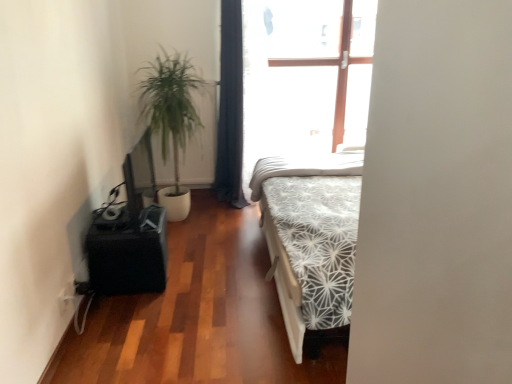
Question: Does black matte table at left appear on the left side of white textured mattress at center?

Choices:
 (A) no
 (B) yes

Answer: (B)

Question: Is the depth of black matte table at left less than that of white textured mattress at center?

Choices:
 (A) no
 (B) yes

Answer: (B)

Question: Is black matte table at left beside white textured mattress at center?

Choices:
 (A) yes
 (B) no

Answer: (B)

Question: Can you confirm if black matte table at left is bigger than white textured mattress at center?

Choices:
 (A) no
 (B) yes

Answer: (A)

Question: From the image's perspective, is black matte table at left located above white textured mattress at center?

Choices:
 (A) yes
 (B) no

Answer: (B)

Question: Considering the relative positions of dark blue fabric curtain at center and green leafy plant at left in the image provided, is dark blue fabric curtain at center to the left or to the right of green leafy plant at left?

Choices:
 (A) left
 (B) right

Answer: (B)

Question: Considering the positions of dark blue fabric curtain at center and green leafy plant at left in the image, is dark blue fabric curtain at center wider or thinner than green leafy plant at left?

Choices:
 (A) thin
 (B) wide

Answer: (A)

Question: From a real-world perspective, is dark blue fabric curtain at center above or below green leafy plant at left?

Choices:
 (A) below
 (B) above

Answer: (B)

Question: Based on their sizes in the image, would you say dark blue fabric curtain at center is bigger or smaller than green leafy plant at left?

Choices:
 (A) big
 (B) small

Answer: (B)

Question: In the image, is black matte table at left positioned in front of or behind green leafy plant at left?

Choices:
 (A) behind
 (B) front

Answer: (B)

Question: From a real-world perspective, is black matte table at left positioned above or below green leafy plant at left?

Choices:
 (A) above
 (B) below

Answer: (B)

Question: Is point (140, 218) closer or farther from the camera than point (180, 198)?

Choices:
 (A) farther
 (B) closer

Answer: (B)

Question: Visually, is black matte table at left positioned to the left or to the right of green leafy plant at left?

Choices:
 (A) right
 (B) left

Answer: (B)

Question: From the image's perspective, relative to white textured mattress at center, is green leafy plant at left above or below?

Choices:
 (A) below
 (B) above

Answer: (B)

Question: Visually, is green leafy plant at left positioned to the left or to the right of white textured mattress at center?

Choices:
 (A) right
 (B) left

Answer: (B)